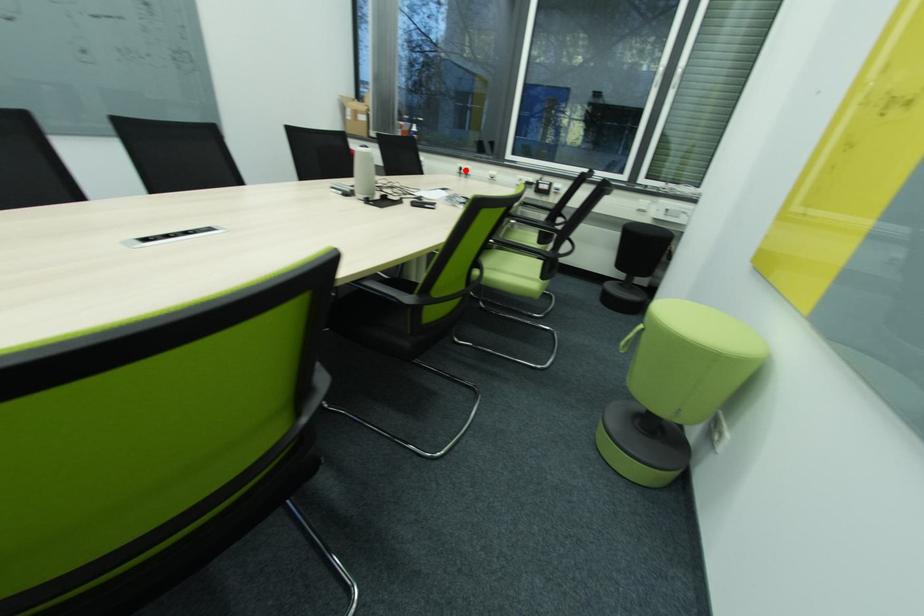
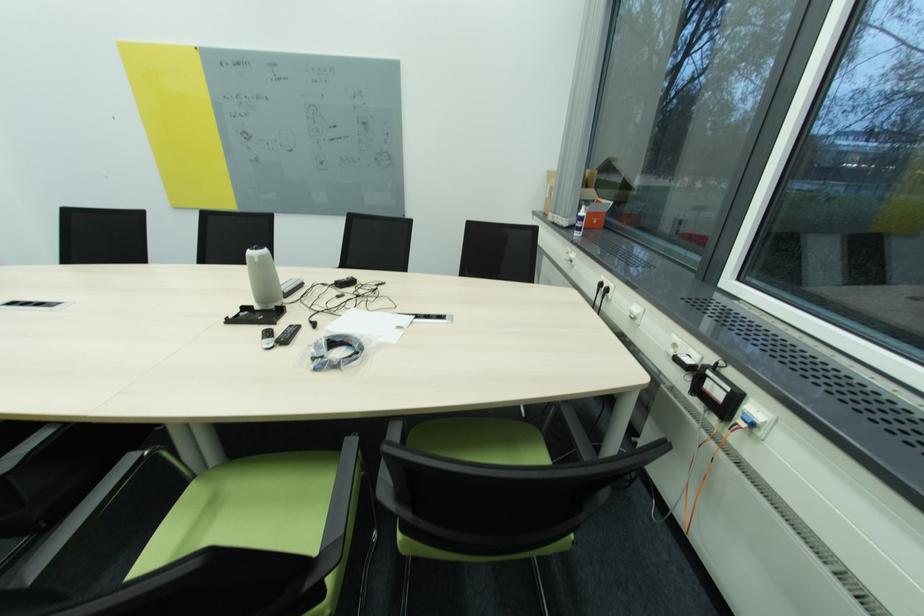
Locate, in the second image, the point that corresponds to the highlighted location in the first image.

(604, 286)